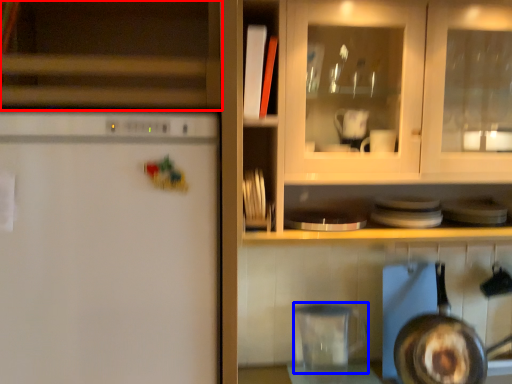
Question: Among these objects, which one is nearest to the camera, cabinetry (highlighted by a red box) or appliance (highlighted by a blue box)?

Choices:
 (A) cabinetry
 (B) appliance

Answer: (A)